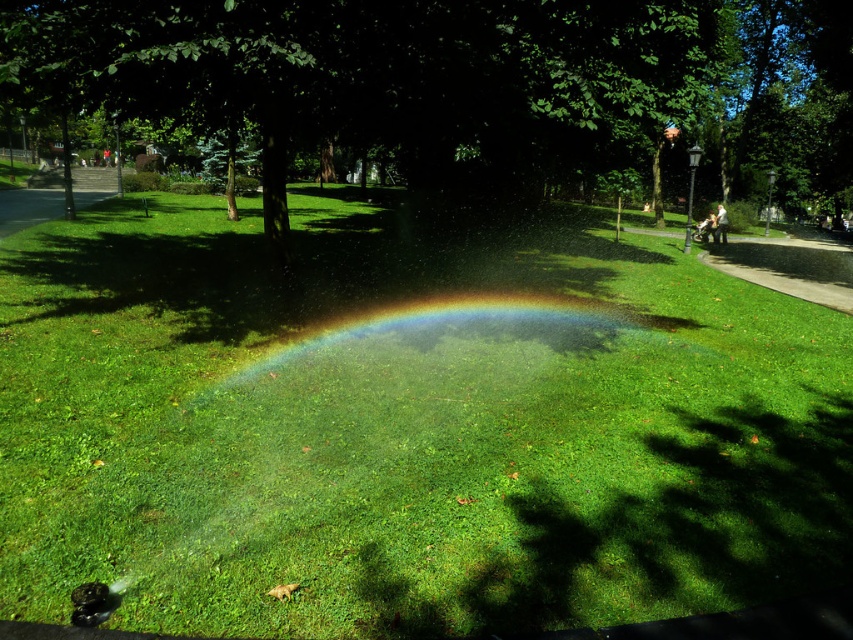
Question: Among these objects, which one is nearest to the camera?

Choices:
 (A) rainbow at center
 (B) green leafy tree at center
 (C) green grass at center

Answer: (C)

Question: Is green leafy tree at center to the right of rainbow at center from the viewer's perspective?

Choices:
 (A) no
 (B) yes

Answer: (B)

Question: Which of these objects is positioned farthest from the rainbow at center?

Choices:
 (A) green leafy tree at center
 (B) green grass at center

Answer: (A)

Question: Does green leafy tree at center have a greater width compared to rainbow at center?

Choices:
 (A) no
 (B) yes

Answer: (B)

Question: Which of the following is the farthest from the observer?

Choices:
 (A) green leafy tree at center
 (B) green grass at center

Answer: (A)

Question: Does green grass at center have a smaller size compared to rainbow at center?

Choices:
 (A) no
 (B) yes

Answer: (A)